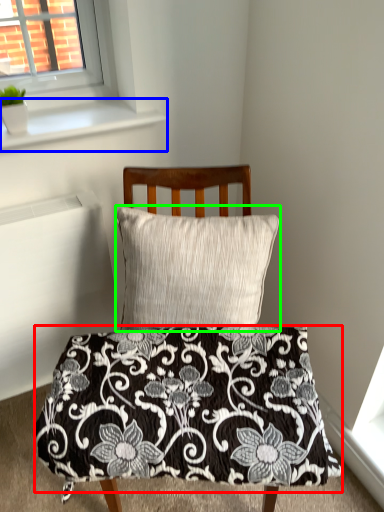
Question: Based on their relative distances, which object is nearer to blanket (highlighted by a red box)? Choose from window sill (highlighted by a blue box) and pillow (highlighted by a green box).

Choices:
 (A) window sill
 (B) pillow

Answer: (B)